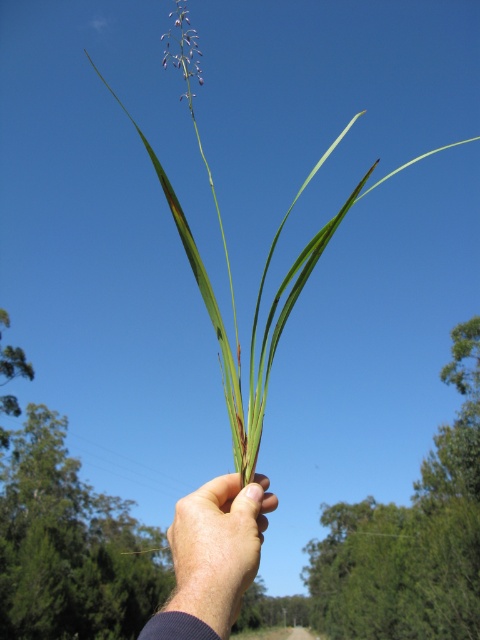
In the scene shown: You are a botanist examining a plant specimen. You notice the skinny green leaf at center and the purple matte flower at upper center. Based on their positions, which one is closer to the base of the plant?

The skinny green leaf at center is closer to the base of the plant because it is positioned under the purple matte flower at upper center.

You are a botanist examining the plant in the image. You need to determine which part is smaller between the skinny green leaf at center and the purple matte flower at upper center. Which one is smaller?

The skinny green leaf at center is smaller compared to the purple matte flower at upper center.

You are a botanist examining the plant in the image. You notice the skinny green leaf at center and the purple matte flower at upper center. Which part is closer to your eyes?

The skinny green leaf at center is closer to the viewer than the purple matte flower at upper center.